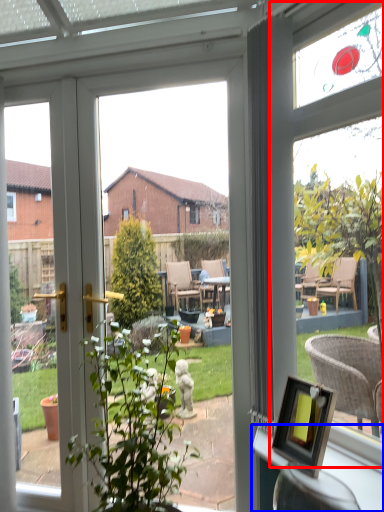
Question: Which object appears closest to the camera in this image, bay window (highlighted by a red box) or window sill (highlighted by a blue box)?

Choices:
 (A) bay window
 (B) window sill

Answer: (B)